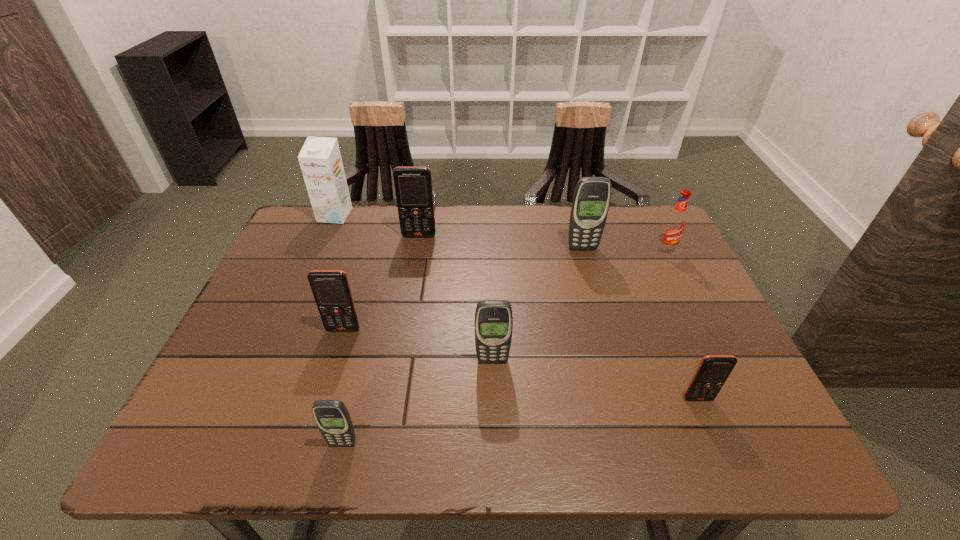
Locate an element on the screen. the farthest object is located at coordinates pyautogui.click(x=320, y=160).

What are the coordinates of `carton` in the screenshot? It's located at (320, 160).

The image size is (960, 540). Find the location of `the farthest cellular telephone`. the farthest cellular telephone is located at coordinates (413, 185).

You are a GUI agent. You are given a task and a screenshot of the screen. Output one action in this format:
    pyautogui.click(x=<x>, y=<y>)
    Task: Click on the second farthest object
    The height and width of the screenshot is (540, 960).
    Given the screenshot: What is the action you would take?
    pyautogui.click(x=413, y=185)

What are the coordinates of `the rightmost gray cellular telephone` in the screenshot? It's located at (592, 196).

Image resolution: width=960 pixels, height=540 pixels. Find the location of `the fifth cellular telephone from left to right`. the fifth cellular telephone from left to right is located at coordinates (592, 196).

At what (x,y) coordinates should I click in order to perform the action: click on root beer. Please return your answer as a coordinate pair (x, y). The width and height of the screenshot is (960, 540). Looking at the image, I should click on (674, 225).

Locate an element on the screen. This screenshot has width=960, height=540. the rightmost object is located at coordinates (674, 225).

Image resolution: width=960 pixels, height=540 pixels. Identify the location of the second biggest gray cellular telephone. (493, 318).

The image size is (960, 540). What are the coordinates of `the second nearest gray cellular telephone` in the screenshot? It's located at (493, 318).